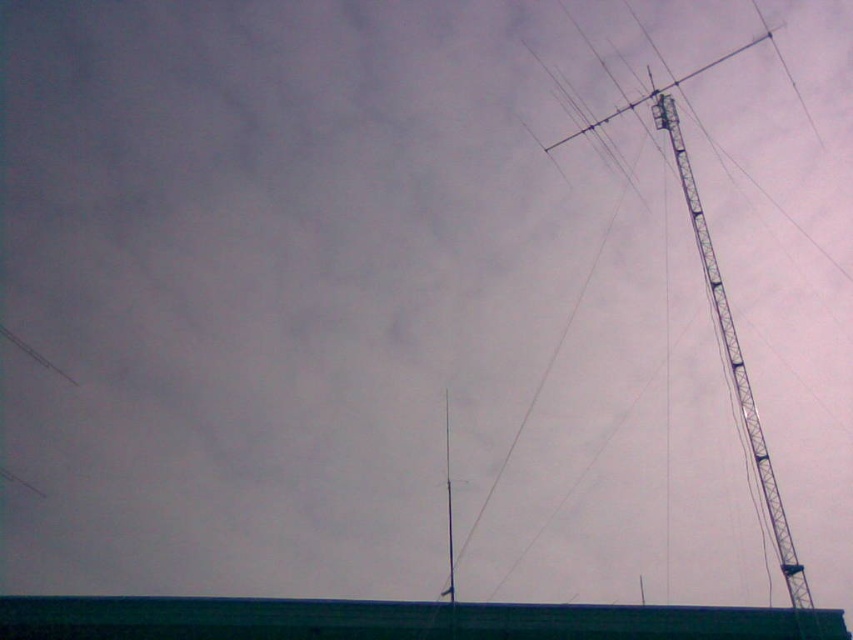
Can you confirm if metallic tower at right is wider than metallic pole at center?

Yes.

Is point (665, 84) farther from camera compared to point (451, 570)?

Yes, point (665, 84) is behind point (451, 570).

You are a GUI agent. You are given a task and a screenshot of the screen. Output one action in this format:
    pyautogui.click(x=<x>, y=<y>)
    Task: Click on the metallic tower at right
    This screenshot has width=853, height=640.
    Given the screenshot: What is the action you would take?
    pyautogui.click(x=718, y=308)